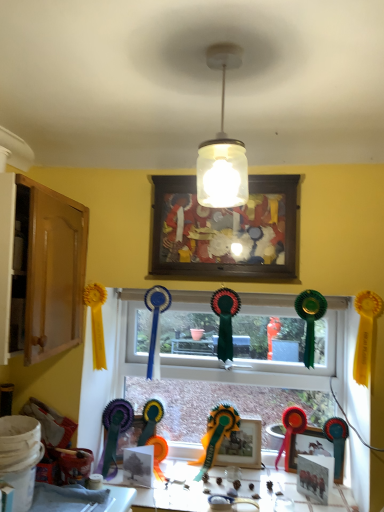
Image resolution: width=384 pixels, height=512 pixels. In order to click on empty space that is ontop of white glossy table at lower center in this screenshot , I will do `click(218, 483)`.